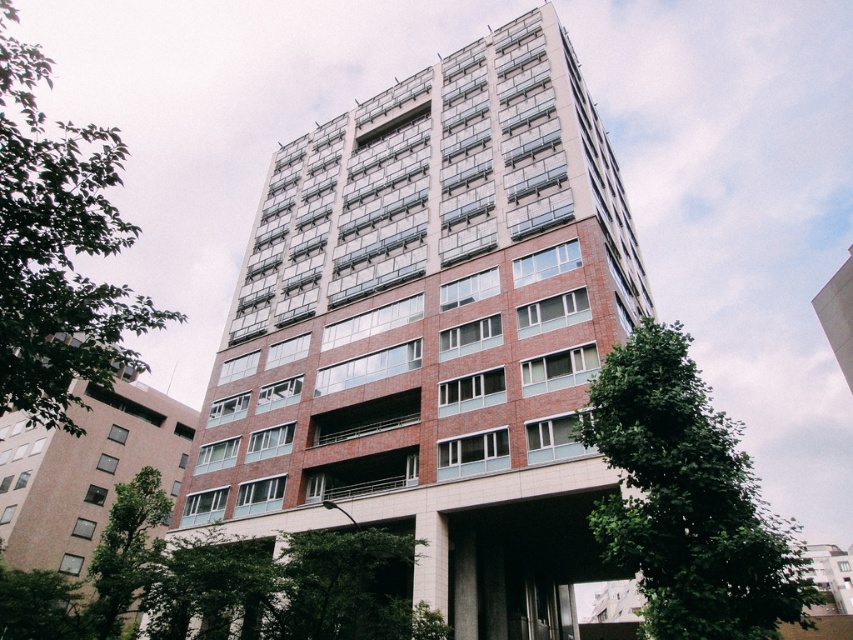
Question: Which of the following is the closest to the observer?

Choices:
 (A) green leafy tree at left
 (B) green leafy tree at lower center
 (C) green leafy tree at lower right
 (D) green leafy tree at lower left

Answer: (A)

Question: Among these objects, which one is nearest to the camera?

Choices:
 (A) green leafy tree at lower center
 (B) green leafy tree at lower right
 (C) green leafy tree at lower left

Answer: (B)

Question: Which object is closer to the camera taking this photo?

Choices:
 (A) green leafy tree at left
 (B) green leafy tree at lower left

Answer: (A)

Question: Can you confirm if green leafy tree at left is positioned to the right of green leafy tree at lower center?

Choices:
 (A) yes
 (B) no

Answer: (B)

Question: Is green leafy tree at lower right to the right of green leafy tree at left from the viewer's perspective?

Choices:
 (A) yes
 (B) no

Answer: (A)

Question: Does green leafy tree at left have a smaller size compared to green leafy tree at lower left?

Choices:
 (A) no
 (B) yes

Answer: (A)